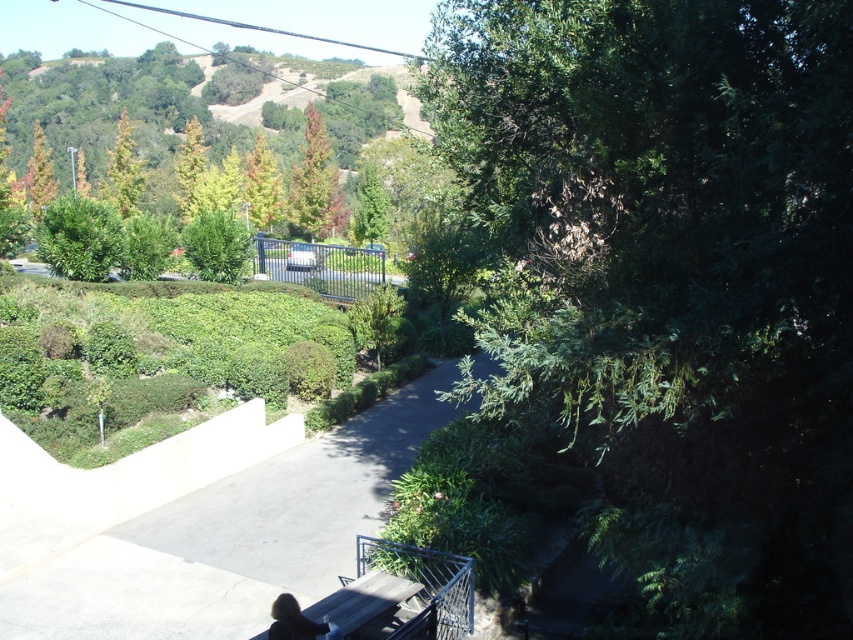
Question: Does green leafy tree at right appear on the left side of green leafy tree at upper left?

Choices:
 (A) yes
 (B) no

Answer: (B)

Question: Which object is the farthest from the smooth concrete path at center?

Choices:
 (A) green leafy tree at right
 (B) dark brown leather jacket at lower center
 (C) green matte tree at center

Answer: (C)

Question: Which object is positioned closest to the green leafy tree at upper left?

Choices:
 (A) smooth concrete path at center
 (B) dark brown leather jacket at lower center
 (C) green matte tree at center
 (D) green leafy tree at right

Answer: (C)

Question: Is green matte tree at center positioned in front of dark brown leather jacket at lower center?

Choices:
 (A) yes
 (B) no

Answer: (B)

Question: Which of the following is the closest to the observer?

Choices:
 (A) click(x=117, y=208)
 (B) click(x=263, y=508)

Answer: (B)

Question: Considering the relative positions of green leafy tree at right and smooth concrete path at center in the image provided, where is green leafy tree at right located with respect to smooth concrete path at center?

Choices:
 (A) left
 (B) right

Answer: (B)